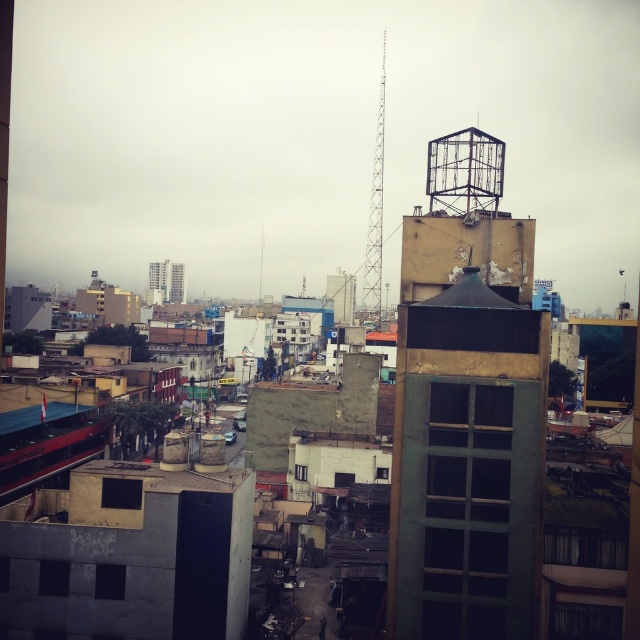
Question: Does rusty metal tower at upper right have a lesser width compared to smooth concrete building at center?

Choices:
 (A) yes
 (B) no

Answer: (A)

Question: Is rusty metal tower at upper right further to the viewer compared to smooth concrete building at center?

Choices:
 (A) yes
 (B) no

Answer: (B)

Question: Is rusty metal tower at upper right positioned in front of smooth concrete building at center?

Choices:
 (A) no
 (B) yes

Answer: (B)

Question: Which point is farther from the camera taking this photo?

Choices:
 (A) (150, 282)
 (B) (452, 449)

Answer: (A)